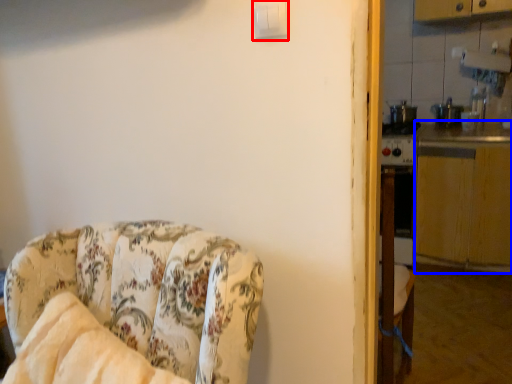
Question: Which of the following is the closest to the observer, light switch (highlighted by a red box) or counter top (highlighted by a blue box)?

Choices:
 (A) light switch
 (B) counter top

Answer: (A)